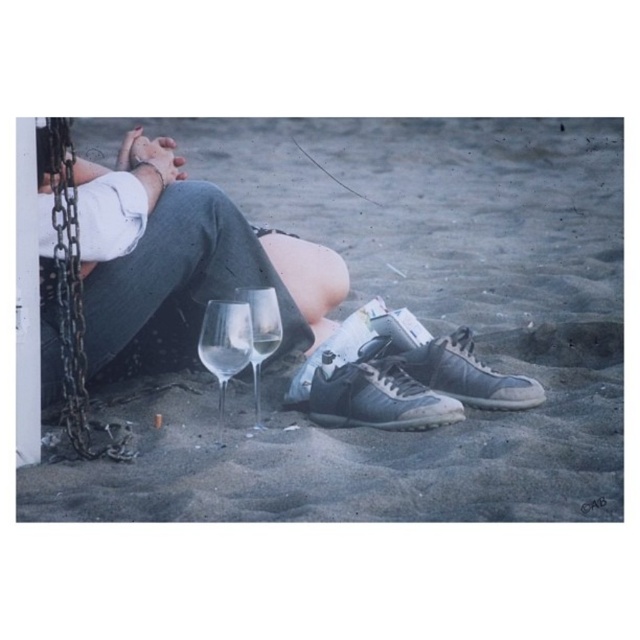
Question: Is gray suede sneaker at lower center below transparent glass at center?

Choices:
 (A) no
 (B) yes

Answer: (A)

Question: Which object is positioned farthest from the clear glass wine at center?

Choices:
 (A) matte black shoes at lower center
 (B) rusty metal chain at left
 (C) clear glass wine glass at lower center

Answer: (A)

Question: Which point is farther to the camera?

Choices:
 (A) clear glass wine at lower center
 (B) rusty metal chain at left
 (C) clear glass wine at center
 (D) matte black shoes at lower center

Answer: (C)

Question: Among these objects, which one is farthest from the camera?

Choices:
 (A) clear glass wine at center
 (B) clear glass wine at lower center
 (C) leather sneakers at lower center

Answer: (C)

Question: Does rusty metal chain at left appear on the left side of clear glass wine glass at lower center?

Choices:
 (A) no
 (B) yes

Answer: (B)

Question: Is gray suede sneaker at lower center smaller than clear glass wine glass at lower center?

Choices:
 (A) no
 (B) yes

Answer: (B)